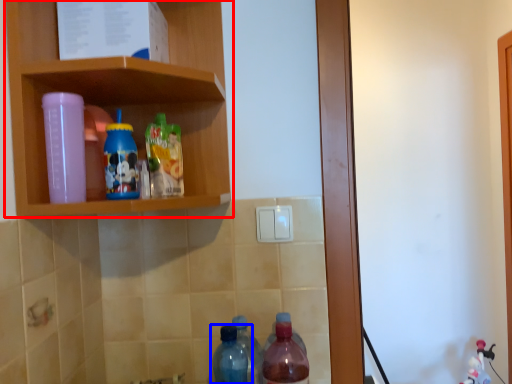
Question: Which of the following is the farthest to the observer, shelf (highlighted by a red box) or bottle (highlighted by a blue box)?

Choices:
 (A) shelf
 (B) bottle

Answer: (B)